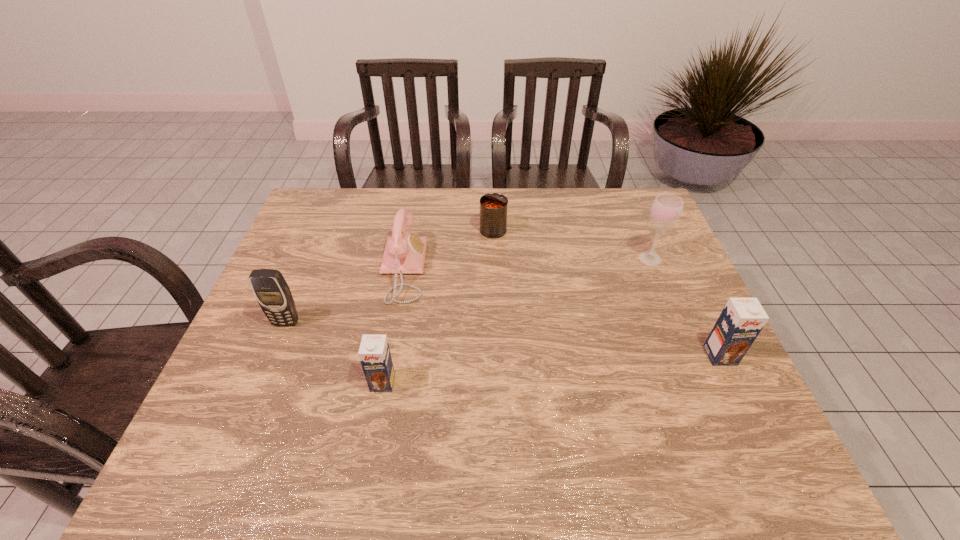
Please point a location where one more chocolate_milk can be added evenly. Please provide its 2D coordinates. Your answer should be formatted as a tuple, i.e. [(x, y)], where the tuple contains the x and y coordinates of a point satisfying the conditions above.

[(556, 369)]